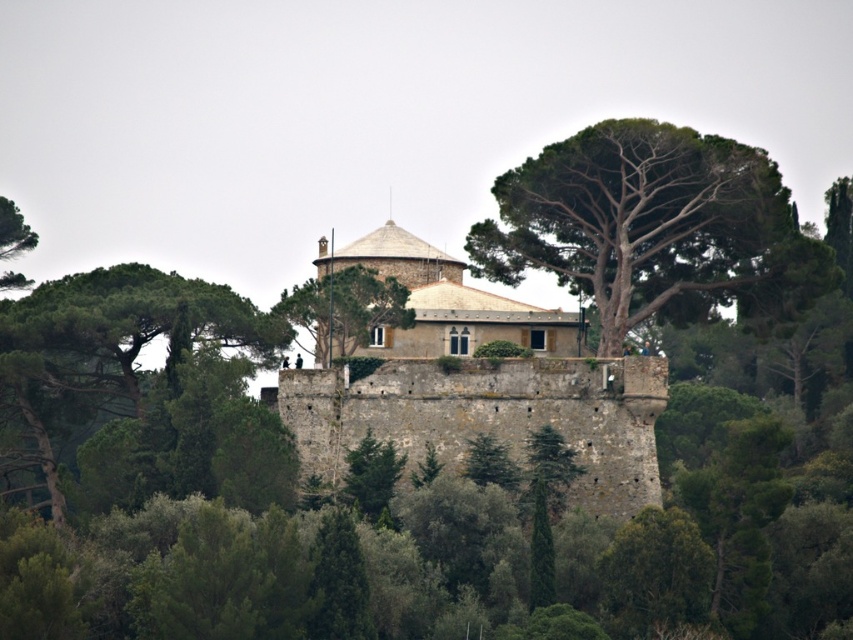
Question: Which object appears closest to the camera in this image?

Choices:
 (A) stone castle at center
 (B) green rough bark tree at center
 (C) green leafy tree at left
 (D) green leafy tree at center

Answer: (A)

Question: Which point is farther to the camera?

Choices:
 (A) green rough bark tree at center
 (B) green leafy tree at center
 (C) green leafy tree at left
 (D) stone castle at center

Answer: (C)

Question: Can you confirm if stone castle at center is positioned below green rough bark tree at center?

Choices:
 (A) no
 (B) yes

Answer: (B)

Question: Does green leafy tree at center come behind green leafy tree at left?

Choices:
 (A) no
 (B) yes

Answer: (A)

Question: Is stone castle at center positioned in front of green leafy tree at left?

Choices:
 (A) yes
 (B) no

Answer: (A)

Question: Which object is the closest to the stone castle at center?

Choices:
 (A) green rough bark tree at center
 (B) green leafy tree at left
 (C) green leafy tree at center

Answer: (C)